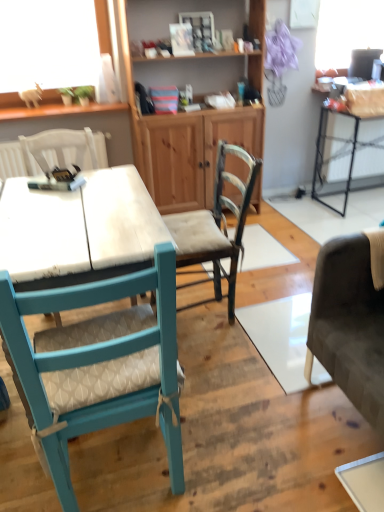
Find the location of a particular element. metallic black table at right is located at coordinates point(339,153).

Describe the element at coordinates (339, 153) in the screenshot. I see `metallic black table at right` at that location.

Describe the element at coordinates (183, 117) in the screenshot. I see `wooden cabinet at center` at that location.

This screenshot has width=384, height=512. Describe the element at coordinates (97, 362) in the screenshot. I see `teal fabric chair at left, arranged as the second chair when viewed from the left` at that location.

The height and width of the screenshot is (512, 384). I want to click on teal fabric chair at left, which is the 2th chair in right-to-left order, so click(x=97, y=362).

I want to click on wooden textured chair at center, arranged as the third chair when viewed from the left, so click(x=216, y=226).

Is white fabric chair at upper left, the first chair when ordered from left to right, facing towards wooden textured chair at center, positioned as the first chair in right-to-left order?

No.

What are the coordinates of `chair that is the 2nd one above the wooden textured chair at center, positioned as the first chair in right-to-left order (from a real-world perspective)` in the screenshot? It's located at (63, 150).

From the image's perspective, is white fabric chair at upper left, the first chair when ordered from left to right, above or below wooden textured chair at center, arranged as the third chair when viewed from the left?

Clearly, from the image's perspective, white fabric chair at upper left, the first chair when ordered from left to right, is above wooden textured chair at center, arranged as the third chair when viewed from the left.

Who is smaller, white fabric chair at upper left, the first chair when ordered from left to right, or wooden textured chair at center, arranged as the third chair when viewed from the left?

Smaller between the two is white fabric chair at upper left, the first chair when ordered from left to right.

Is wooden textured chair at center, positioned as the first chair in right-to-left order, beside metallic black table at right?

No, wooden textured chair at center, positioned as the first chair in right-to-left order, is not with metallic black table at right.

Can we say wooden textured chair at center, positioned as the first chair in right-to-left order, lies outside metallic black table at right?

Yes, wooden textured chair at center, positioned as the first chair in right-to-left order, is not within metallic black table at right.

Between wooden textured chair at center, arranged as the third chair when viewed from the left, and metallic black table at right, which one appears on the right side from the viewer's perspective?

metallic black table at right.

From the image's perspective, is wooden cabinet at center beneath white fabric chair at upper left, the first chair when ordered from left to right?

No, from the image's perspective, wooden cabinet at center is not beneath white fabric chair at upper left, the first chair when ordered from left to right.

The width and height of the screenshot is (384, 512). I want to click on chair that is the 3rd one when counting leftward from the wooden cabinet at center, so click(63, 150).

Would you say wooden cabinet at center is outside white fabric chair at upper left, which is the third chair from right to left?

Yes.

Measure the distance between teal fabric chair at left, arranged as the second chair when viewed from the left, and wooden cabinet at center.

They are 1.95 meters apart.

Considering the relative positions of teal fabric chair at left, which is the 2th chair in right-to-left order, and wooden cabinet at center in the image provided, is teal fabric chair at left, which is the 2th chair in right-to-left order, to the left of wooden cabinet at center from the viewer's perspective?

Indeed, teal fabric chair at left, which is the 2th chair in right-to-left order, is positioned on the left side of wooden cabinet at center.

Is teal fabric chair at left, arranged as the second chair when viewed from the left, beside wooden cabinet at center?

No, teal fabric chair at left, arranged as the second chair when viewed from the left, is not with wooden cabinet at center.

From the image's perspective, which is below, teal fabric chair at left, arranged as the second chair when viewed from the left, or wooden cabinet at center?

teal fabric chair at left, arranged as the second chair when viewed from the left, appears lower in the image.

Would you say metallic black table at right contains white fabric chair at upper left, which is the third chair from right to left?

No, metallic black table at right does not contain white fabric chair at upper left, which is the third chair from right to left.

In terms of size, does metallic black table at right appear bigger or smaller than white fabric chair at upper left, the first chair when ordered from left to right?

In the image, metallic black table at right appears to be larger than white fabric chair at upper left, the first chair when ordered from left to right.

The width and height of the screenshot is (384, 512). I want to click on table below the white fabric chair at upper left, which is the third chair from right to left (from a real-world perspective), so click(339, 153).

Considering the points (351, 179) and (29, 144), which point is behind, point (351, 179) or point (29, 144)?

The point (351, 179) is more distant.

Identify the location of chair positioned vertically above the teal fabric chair at left, arranged as the second chair when viewed from the left (from a real-world perspective). (63, 150).

From the image's perspective, between white fabric chair at upper left, the first chair when ordered from left to right, and teal fabric chair at left, which is the 2th chair in right-to-left order, which one is located above?

white fabric chair at upper left, the first chair when ordered from left to right, is shown above in the image.

Is white fabric chair at upper left, the first chair when ordered from left to right, turned away from teal fabric chair at left, which is the 2th chair in right-to-left order?

No, white fabric chair at upper left, the first chair when ordered from left to right,'s orientation is not away from teal fabric chair at left, which is the 2th chair in right-to-left order.

Is white fabric chair at upper left, which is the third chair from right to left, not within teal fabric chair at left, arranged as the second chair when viewed from the left?

That's correct, white fabric chair at upper left, which is the third chair from right to left, is outside of teal fabric chair at left, arranged as the second chair when viewed from the left.

From the image's perspective, which one is positioned lower, wooden textured chair at center, arranged as the third chair when viewed from the left, or white fabric chair at upper left, the first chair when ordered from left to right?

From the image's view, wooden textured chair at center, arranged as the third chair when viewed from the left, is below.

Could you tell me if wooden textured chair at center, positioned as the first chair in right-to-left order, is turned towards white fabric chair at upper left, the first chair when ordered from left to right?

No, wooden textured chair at center, positioned as the first chair in right-to-left order, is not aimed at white fabric chair at upper left, the first chair when ordered from left to right.

From a real-world perspective, is wooden textured chair at center, arranged as the third chair when viewed from the left, located beneath white fabric chair at upper left, which is the third chair from right to left?

Correct, in the physical world, wooden textured chair at center, arranged as the third chair when viewed from the left, is lower than white fabric chair at upper left, which is the third chair from right to left.

Is wooden textured chair at center, arranged as the third chair when viewed from the left, not close to white fabric chair at upper left, the first chair when ordered from left to right?

No, wooden textured chair at center, arranged as the third chair when viewed from the left, is not far from white fabric chair at upper left, the first chair when ordered from left to right.

Where is `the 2nd chair counting from the left side of the wooden textured chair at center, positioned as the first chair in right-to-left order`? the 2nd chair counting from the left side of the wooden textured chair at center, positioned as the first chair in right-to-left order is located at coordinates (63, 150).

At what (x,y) coordinates should I click in order to perform the action: click on table above the wooden textured chair at center, positioned as the first chair in right-to-left order (from the image's perspective). Please return your answer as a coordinate pair (x, y). The height and width of the screenshot is (512, 384). Looking at the image, I should click on (339, 153).

Estimate the real-world distances between objects in this image. Which object is closer to metallic black table at right, wooden cabinet at center or wooden textured chair at center, arranged as the third chair when viewed from the left?

wooden cabinet at center.

Based on their spatial positions, is white fabric chair at upper left, the first chair when ordered from left to right, or metallic black table at right further from wooden textured chair at center, arranged as the third chair when viewed from the left?

Among the two, metallic black table at right is located further to wooden textured chair at center, arranged as the third chair when viewed from the left.

Considering their positions, is wooden cabinet at center positioned further to wooden textured chair at center, positioned as the first chair in right-to-left order, than teal fabric chair at left, arranged as the second chair when viewed from the left?

Based on the image, wooden cabinet at center appears to be further to wooden textured chair at center, positioned as the first chair in right-to-left order.

From the image, which object appears to be nearer to metallic black table at right, white fabric chair at upper left, which is the third chair from right to left, or wooden cabinet at center?

The object closer to metallic black table at right is wooden cabinet at center.

Which object lies nearer to the anchor point wooden cabinet at center, wooden textured chair at center, arranged as the third chair when viewed from the left, or white fabric chair at upper left, which is the third chair from right to left?

white fabric chair at upper left, which is the third chair from right to left, is positioned closer to the anchor wooden cabinet at center.

From the image, which object appears to be nearer to teal fabric chair at left, arranged as the second chair when viewed from the left, wooden textured chair at center, arranged as the third chair when viewed from the left, or wooden cabinet at center?

wooden textured chair at center, arranged as the third chair when viewed from the left.

Looking at this image, from the image, which object appears to be farther from white fabric chair at upper left, the first chair when ordered from left to right, metallic black table at right or wooden cabinet at center?

metallic black table at right is positioned further to the anchor white fabric chair at upper left, the first chair when ordered from left to right.

Estimate the real-world distances between objects in this image. Which object is further from white fabric chair at upper left, which is the third chair from right to left, metallic black table at right or wooden textured chair at center, arranged as the third chair when viewed from the left?

Among the two, metallic black table at right is located further to white fabric chair at upper left, which is the third chair from right to left.

I want to click on cabinetry positioned between teal fabric chair at left, arranged as the second chair when viewed from the left, and metallic black table at right from near to far, so click(183, 117).

Locate an element on the screen. The image size is (384, 512). chair that lies between wooden cabinet at center and wooden textured chair at center, positioned as the first chair in right-to-left order, from top to bottom is located at coordinates (63, 150).

The width and height of the screenshot is (384, 512). I want to click on chair between teal fabric chair at left, which is the 2th chair in right-to-left order, and white fabric chair at upper left, the first chair when ordered from left to right, in the front-back direction, so click(216, 226).

This screenshot has width=384, height=512. What are the coordinates of `cabinetry situated between wooden textured chair at center, arranged as the third chair when viewed from the left, and metallic black table at right from left to right` in the screenshot? It's located at (183, 117).